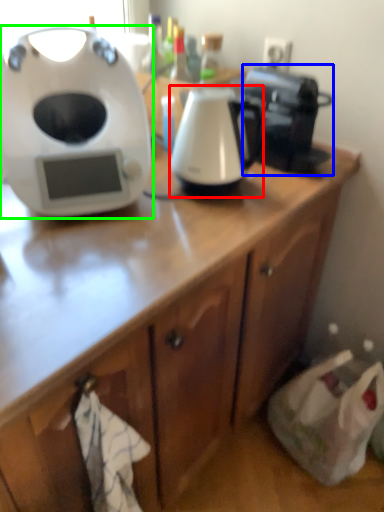
Question: Which object is positioned closest to kitchen appliance (highlighted by a red box)? Select from coffee maker (highlighted by a blue box) and home appliance (highlighted by a green box).

Choices:
 (A) coffee maker
 (B) home appliance

Answer: (A)